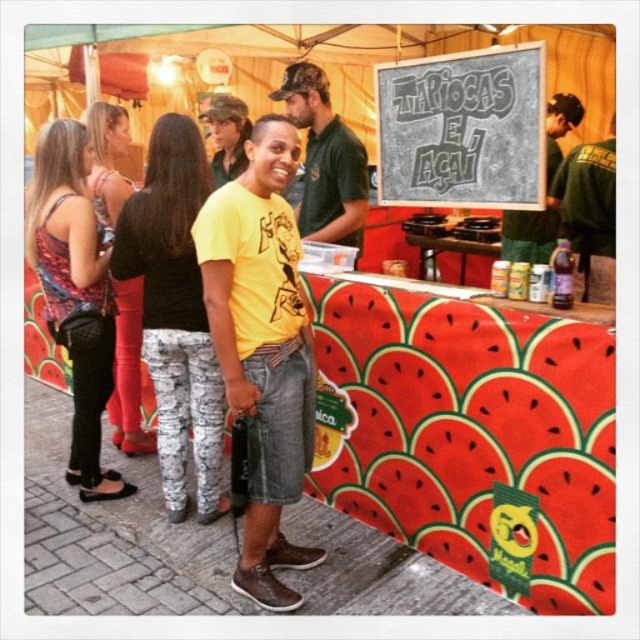
Question: Among these objects, which one is nearest to the camera?

Choices:
 (A) matte black tank top at left
 (B) camouflage pants at center
 (C) chalkboard sign at upper center
 (D) yellow matte shirt at center

Answer: (C)

Question: Which of these objects is positioned closest to the matte black tank top at left?

Choices:
 (A) green cotton shirt at center
 (B) chalkboard sign at upper center
 (C) printed fabric tank top at left

Answer: (C)

Question: Which point is closer to the camera?

Choices:
 (A) green matte shirt at upper right
 (B) yellow matte t-shirt at center

Answer: (B)

Question: Is green cotton shirt at center below green matte shirt at upper right?

Choices:
 (A) no
 (B) yes

Answer: (B)

Question: Considering the relative positions of printed fabric tank top at left and camouflage fabric cap at upper center in the image provided, where is printed fabric tank top at left located with respect to camouflage fabric cap at upper center?

Choices:
 (A) above
 (B) below

Answer: (B)

Question: Does yellow matte t-shirt at center have a larger size compared to camouflage pants at center?

Choices:
 (A) no
 (B) yes

Answer: (B)